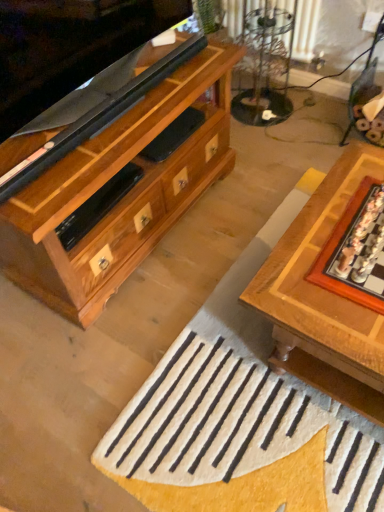
At what (x,y) coordinates should I click in order to perform the action: click on vacant space to the right of clear glass table at upper center. Please return your answer as a coordinate pair (x, y). Image resolution: width=384 pixels, height=512 pixels. Looking at the image, I should click on (322, 115).